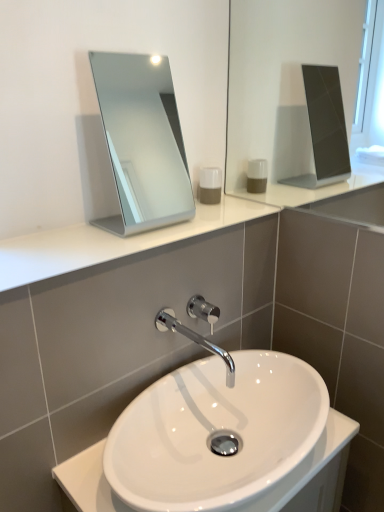
Question: Is white glossy sink at center far from translucent plastic soap dispenser at center?

Choices:
 (A) yes
 (B) no

Answer: (B)

Question: Is white glossy sink at center smaller than translucent plastic soap dispenser at center?

Choices:
 (A) yes
 (B) no

Answer: (B)

Question: Does white glossy sink at center appear on the left side of translucent plastic soap dispenser at center?

Choices:
 (A) yes
 (B) no

Answer: (B)

Question: Is white glossy sink at center oriented away from translucent plastic soap dispenser at center?

Choices:
 (A) yes
 (B) no

Answer: (B)

Question: Is white glossy sink at center thinner than translucent plastic soap dispenser at center?

Choices:
 (A) yes
 (B) no

Answer: (B)

Question: Based on their positions, is white glossy countertop at upper center, positioned as the 2th counter top in bottom-to-top order, located to the left or right of white glossy sink at center?

Choices:
 (A) left
 (B) right

Answer: (A)

Question: Considering the positions of point (223, 214) and point (170, 412), is point (223, 214) closer or farther from the camera than point (170, 412)?

Choices:
 (A) closer
 (B) farther

Answer: (B)

Question: Looking at the image, does white glossy countertop at upper center, arranged as the 1th counter top when viewed from the top, seem bigger or smaller compared to white glossy sink at center?

Choices:
 (A) small
 (B) big

Answer: (A)

Question: Is white glossy countertop at upper center, positioned as the 2th counter top in bottom-to-top order, taller or shorter than white glossy sink at center?

Choices:
 (A) tall
 (B) short

Answer: (B)

Question: Relative to white glossy sink at center, the second counter top viewed from the top, is white glossy countertop at upper center, arranged as the 1th counter top when viewed from the top, in front or behind?

Choices:
 (A) front
 (B) behind

Answer: (B)

Question: Which is correct: white glossy countertop at upper center, positioned as the 2th counter top in bottom-to-top order, is inside white glossy sink at center, the second counter top viewed from the top, or outside of it?

Choices:
 (A) outside
 (B) inside

Answer: (A)

Question: From a real-world perspective, is white glossy countertop at upper center, positioned as the 2th counter top in bottom-to-top order, physically located above or below white glossy sink at center, the second counter top viewed from the top?

Choices:
 (A) below
 (B) above

Answer: (B)

Question: Is white glossy countertop at upper center, arranged as the 1th counter top when viewed from the top, wider or thinner than white glossy sink at center, arranged as the 1th counter top when ordered from the bottom?

Choices:
 (A) thin
 (B) wide

Answer: (A)

Question: From the image's perspective, is white glossy countertop at upper center, positioned as the 2th counter top in bottom-to-top order, above or below silver metallic mirror at upper center?

Choices:
 (A) below
 (B) above

Answer: (A)

Question: Does point (201, 204) appear closer or farther from the camera than point (135, 53)?

Choices:
 (A) closer
 (B) farther

Answer: (A)